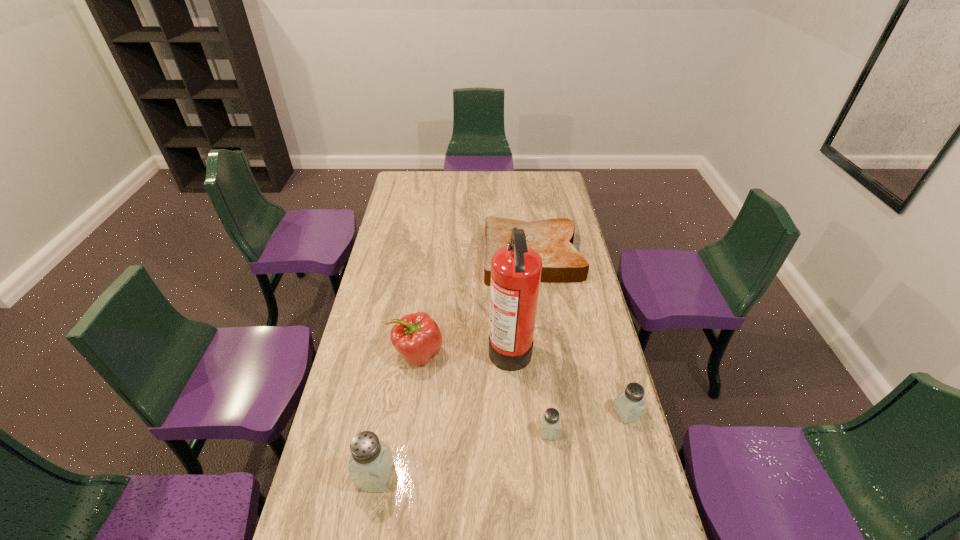
At what (x,y) coordinates should I click in order to perform the action: click on saltshaker located in the right edge section of the desktop. Please return your answer as a coordinate pair (x, y). Looking at the image, I should click on (629, 404).

Where is `bread at the right edge`? This screenshot has width=960, height=540. bread at the right edge is located at coordinates click(x=562, y=263).

In the image, there is a desktop. In order to click on free space at the far edge in this screenshot , I will do `click(523, 180)`.

Find the location of `blank space at the left edge of the desktop`. blank space at the left edge of the desktop is located at coordinates (371, 286).

The height and width of the screenshot is (540, 960). I want to click on free space at the right edge of the desktop, so click(618, 470).

Identify the location of vacant space at the far right corner of the desktop. The width and height of the screenshot is (960, 540). (546, 178).

This screenshot has width=960, height=540. What are the coordinates of `vacant space at the near right corner of the desktop` in the screenshot? It's located at (x=643, y=517).

The height and width of the screenshot is (540, 960). What are the coordinates of `vacant area that lies between the tallest saltshaker and the pepper` in the screenshot? It's located at (396, 414).

Image resolution: width=960 pixels, height=540 pixels. In order to click on free space between the rightmost saltshaker and the fifth tallest object in this screenshot , I will do [x=588, y=422].

Find the location of a particular element. The image size is (960, 540). free area in between the second shortest object and the shortest object is located at coordinates (540, 345).